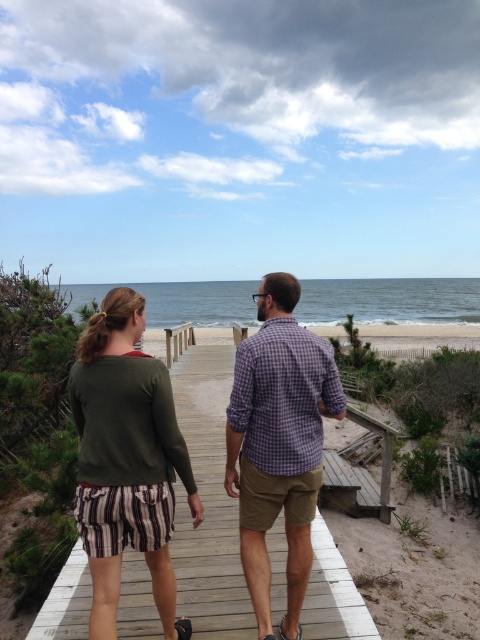
Between point (186, 577) and point (169, 618), which one is positioned behind?

Point (186, 577)

Does wooden boardwalk at center have a greater height compared to green sweater at center?

No.

Which is in front, point (227, 348) or point (94, 536)?

Positioned in front is point (94, 536).

Locate an element on the screen. wooden boardwalk at center is located at coordinates (207, 502).

Is point (132, 324) farther from camera compared to point (296, 353)?

No, it is in front of (296, 353).

Can you confirm if green sweater at center is positioned to the left of purple checkered shirt at center?

Yes, green sweater at center is to the left of purple checkered shirt at center.

Does point (152, 461) come in front of point (237, 472)?

That is True.

Find the location of `green sweater at center`. green sweater at center is located at coordinates (127, 460).

Does wooden boardwalk at center lie in front of purple checkered shirt at center?

No.

Which is more to the right, wooden boardwalk at center or purple checkered shirt at center?

Positioned to the right is purple checkered shirt at center.

Which is behind, point (190, 360) or point (285, 442)?

The point (190, 360) is behind.

Identify the location of wooden boardwalk at center. (207, 502).